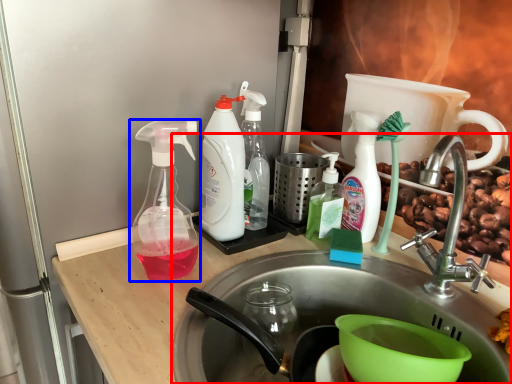
Question: Among these objects, which one is farthest to the camera, sink (highlighted by a red box) or bottle (highlighted by a blue box)?

Choices:
 (A) sink
 (B) bottle

Answer: (B)